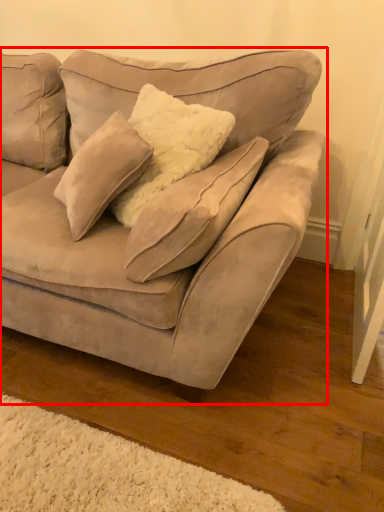
Question: In this image, where is studio couch (annotated by the red box) located relative to pillow?

Choices:
 (A) right
 (B) left

Answer: (B)